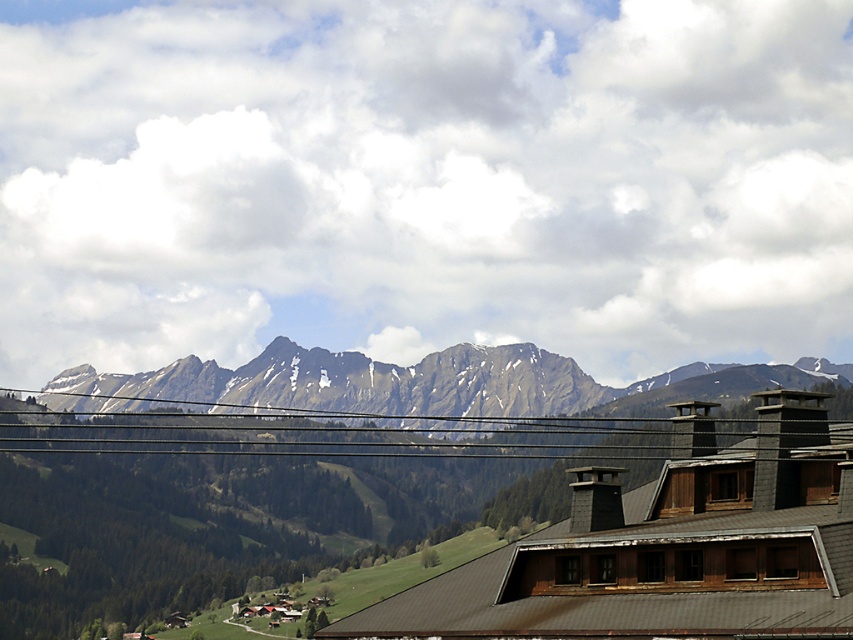
Based on the scene description, where is the point located at coordinates (405, 384)?

The point at coordinates (405, 384) is located on the green textured mountain range at center.

What is the coordinate of the green textured mountain range at center?

The green textured mountain range at center is located at coordinate point (405, 384).